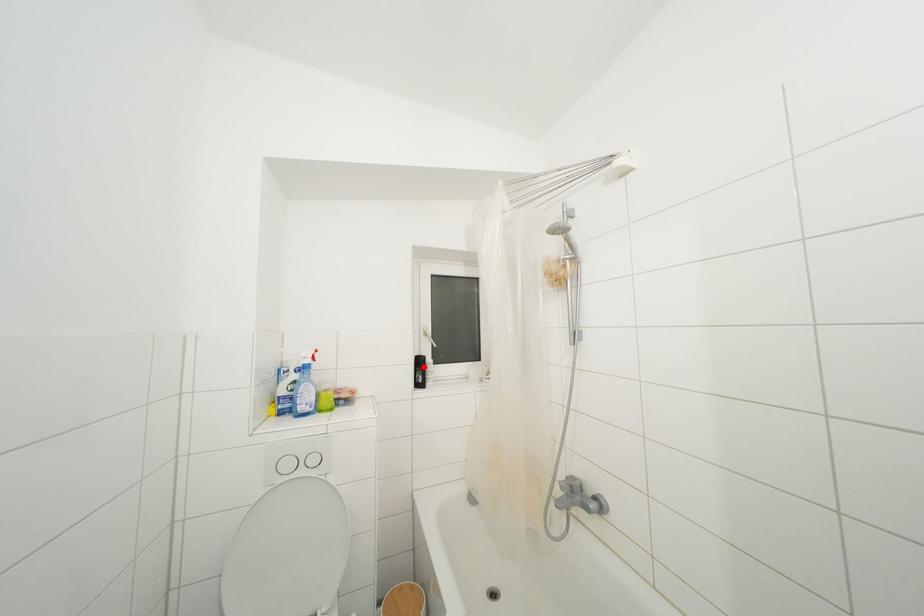
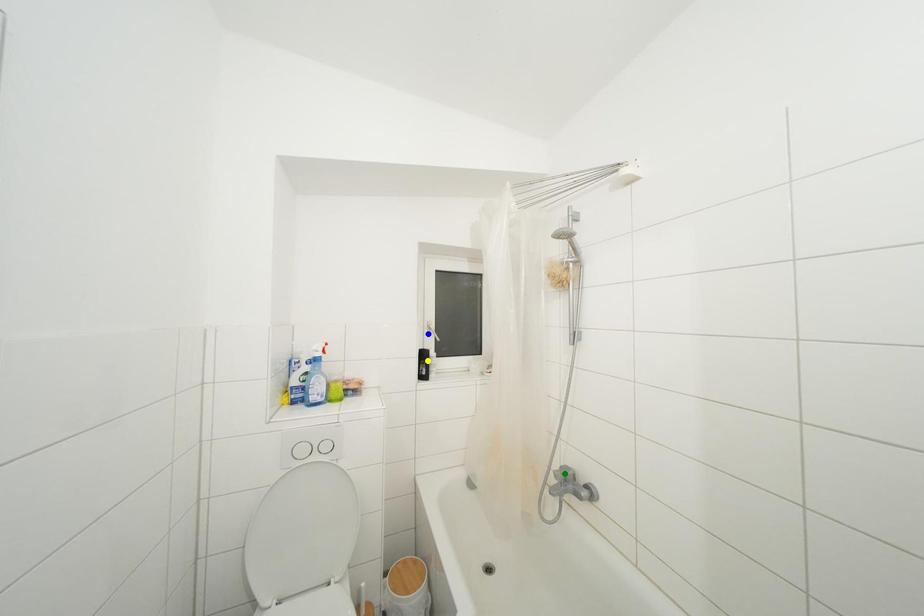
Question: I am providing you with two images of the same scene from different viewpoints. A red point is marked on the first image. You are given multiple points on the second image. Which spot in image 2 lines up with the point in image 1?

Choices:
 (A) yellow point
 (B) blue point
 (C) green point

Answer: (A)